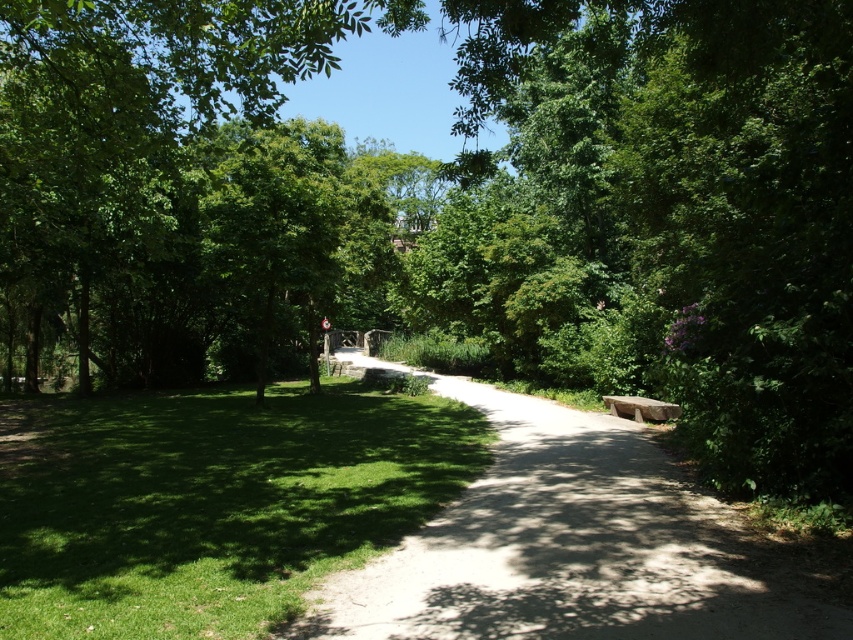
Based on the scene description, where is the dirt path at center located in terms of its 2D coordinates?

The dirt path at center is located at the 2D coordinates of point (x=570, y=545).

You are a hiker who wants to sit down to rest. You see the dirt path at center and the gray stone bench at right. Which one is closer to you?

The dirt path at center is in front of the gray stone bench at right, so the dirt path at center is closer to you.